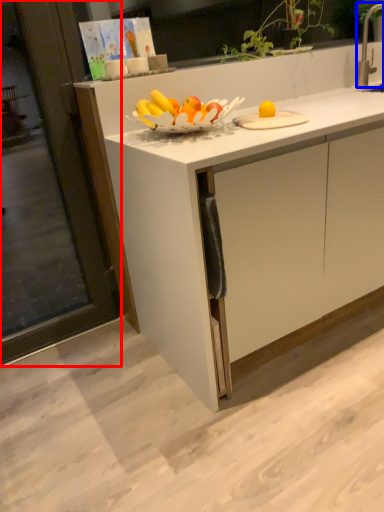
Question: Among these objects, which one is nearest to the camera, screen door (highlighted by a red box) or faucet (highlighted by a blue box)?

Choices:
 (A) screen door
 (B) faucet

Answer: (A)